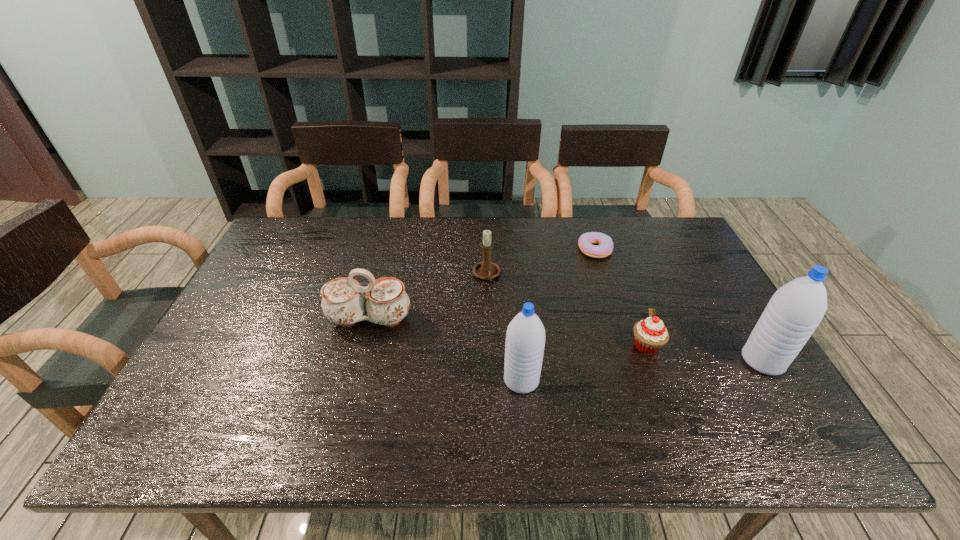
Where is `free space that is in between the chinaware and the doughnut`? The width and height of the screenshot is (960, 540). free space that is in between the chinaware and the doughnut is located at coordinates (482, 285).

At what (x,y) coordinates should I click in order to perform the action: click on vacant area that lies between the taller water bottle and the fifth shortest object. Please return your answer as a coordinate pair (x, y). This screenshot has width=960, height=540. Looking at the image, I should click on coord(642,370).

At what (x,y) coordinates should I click in order to perform the action: click on blank region between the right water bottle and the cupcake. Please return your answer as a coordinate pair (x, y). Looking at the image, I should click on (705, 353).

Identify the location of object that ranks as the closest to the candle holder. This screenshot has height=540, width=960. (343, 302).

This screenshot has height=540, width=960. What are the coordinates of `object that is the third closest to the candle holder` in the screenshot? It's located at (525, 339).

Locate an element on the screen. The width and height of the screenshot is (960, 540). free space that satisfies the following two spatial constraints: 1. on the back side of the shorter water bottle; 2. on the right side of the taller water bottle is located at coordinates 519,361.